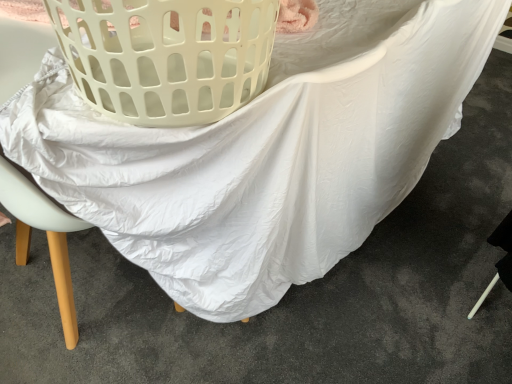
Describe the element at coordinates (46, 234) in the screenshot. I see `white fabric chair at lower left` at that location.

Find the location of a particular element. The image size is (512, 384). white fabric chair at lower left is located at coordinates (46, 234).

The height and width of the screenshot is (384, 512). I want to click on white fabric chair at lower left, so click(46, 234).